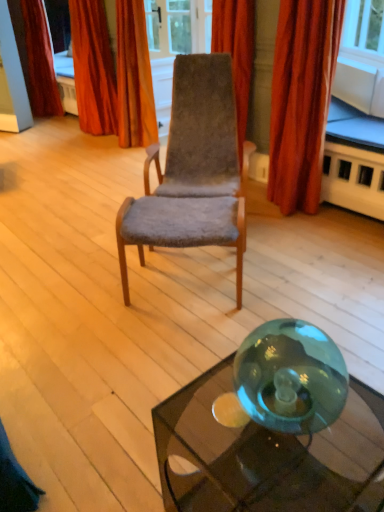
This screenshot has width=384, height=512. I want to click on free space that is to the left of velvet brown chair at center, so click(82, 236).